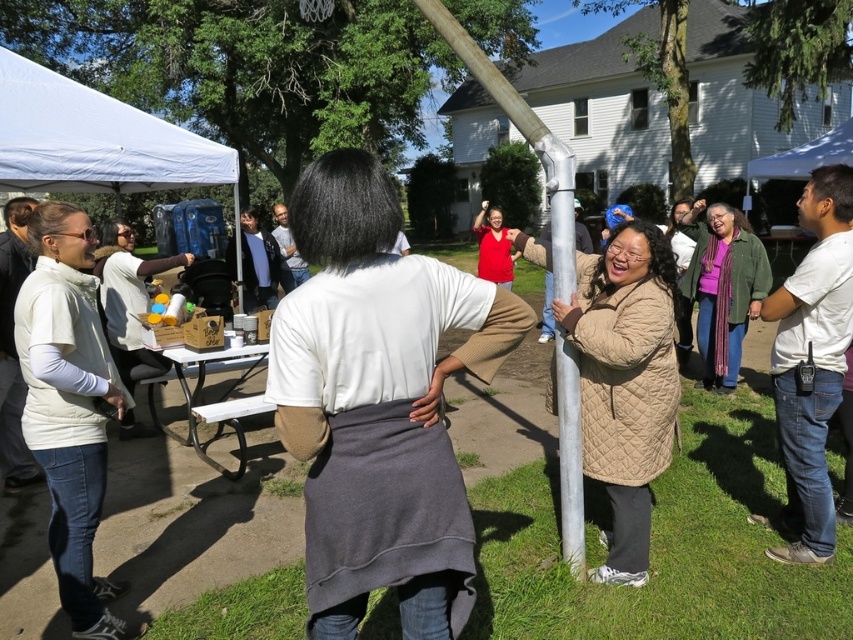
You are organizing a picnic and need to decide where to place a small cooler. You have two options near the basketball hoop. The first option is next to the white cotton shirt at center, and the second is next to the white plastic picnic table at lower left. Which location has more space for the cooler?

The white plastic picnic table at lower left has a larger size compared to the white cotton shirt at center, so placing the cooler next to the white plastic picnic table at lower left would provide more space.

You are at the outdoor gathering and want to sit down at the white plastic picnic table at lower left. To reach it, you need to walk from where you are standing near the matte red shirt at center. In which direction should you head?

You should head to the left to reach the white plastic picnic table at lower left from the matte red shirt at center, since the white plastic picnic table at lower left is located to the left of matte red shirt at center.

Consider the image. You are standing at the center of the image and want to move to the white plastic picnic table at lower left. In which general direction should you walk?

Since the white plastic picnic table at lower left is located at point (213, 401), you should walk towards the lower left direction from the center to reach it.